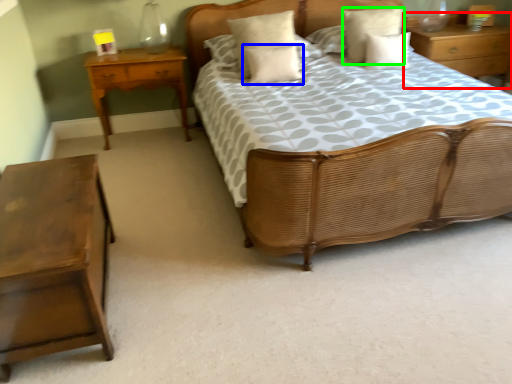
Question: Which object is the closest to the nightstand (highlighted by a red box)? Choose among these: pillow (highlighted by a blue box) or pillow (highlighted by a green box).

Choices:
 (A) pillow
 (B) pillow

Answer: (B)